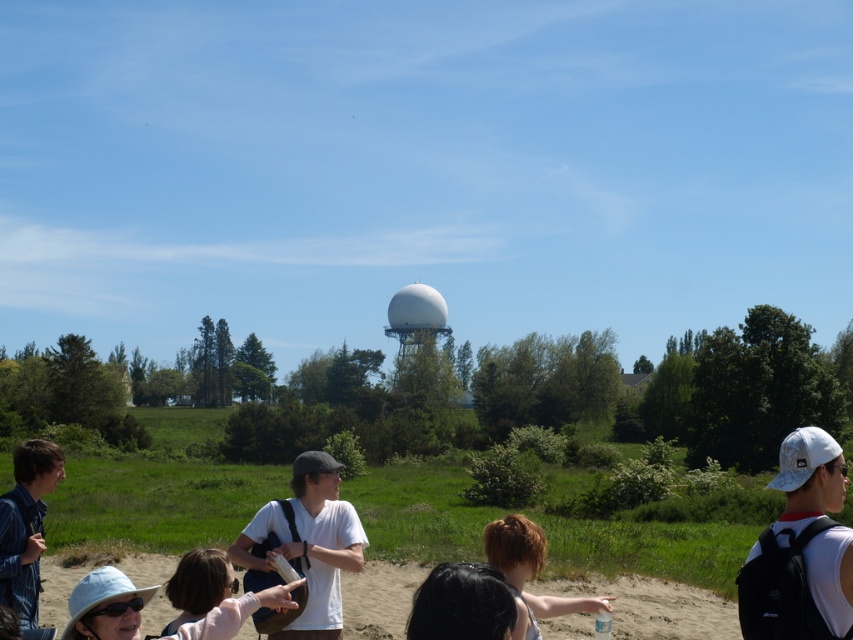
You are a photographer trying to capture a photo of the matte white hat at lower left and the black hair at lower center. The camera you are using has a minimum focus distance of 5 feet. Will both subjects be in focus if you position yourself exactly between them?

The matte white hat at lower left and black hair at lower center are 5.66 feet apart. Since the camera has a minimum focus distance of 5 feet, positioning yourself exactly between them would mean each subject is 2.83 feet away from the camera. This distance is below the minimum focus distance of 5 feet, so neither subject would be in focus.

You are a photographer trying to capture a group photo of the people in the scene. You notice the white matte shirt at center and the denim jacket at lower left. Which clothing item would appear narrower in the photo?

The white matte shirt at center would appear narrower in the photo since it is thinner than the denim jacket at lower left.